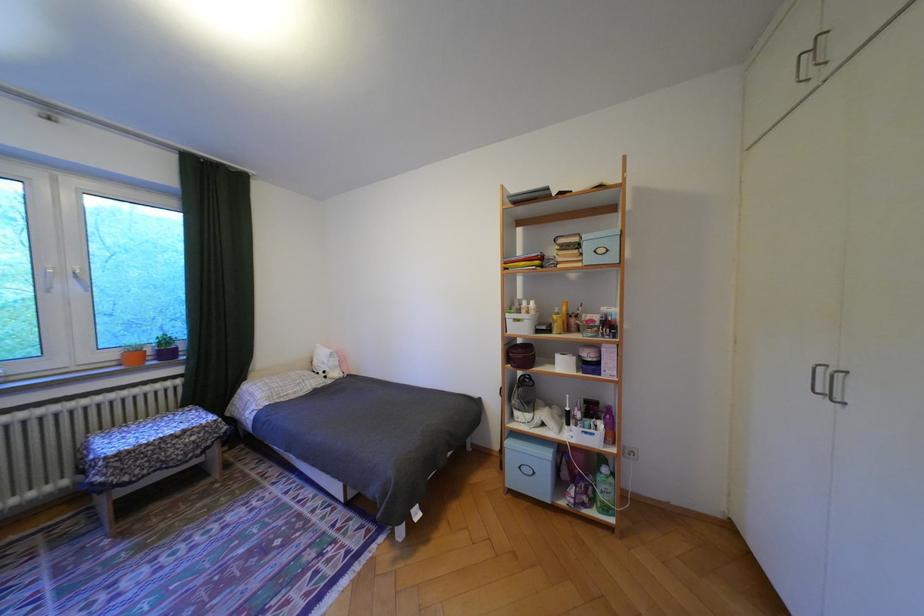
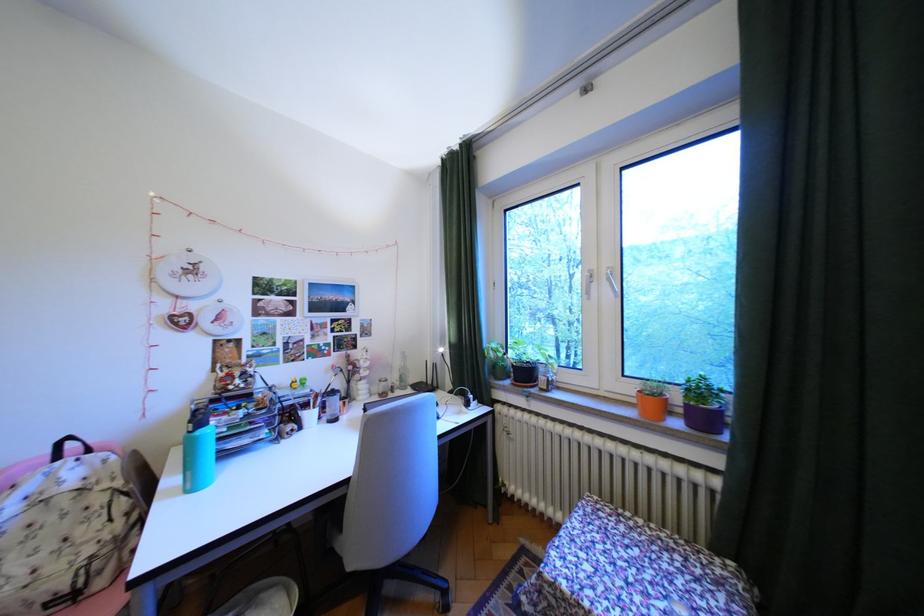
The point at (89, 277) is marked in the first image. Where is the corresponding point in the second image?

(621, 280)